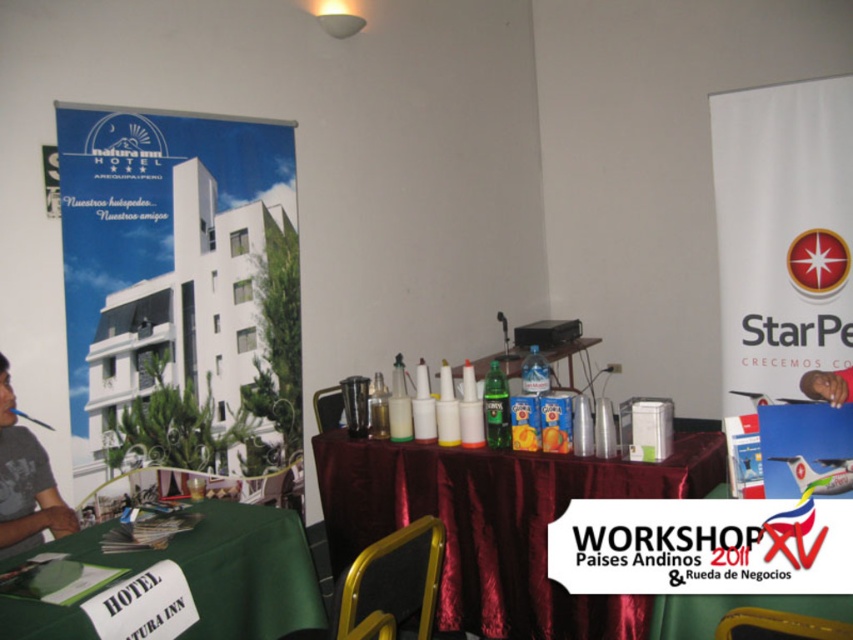
Question: Does maroon satin tablecloth at center appear on the right side of translucent plastic bottles at center?

Choices:
 (A) no
 (B) yes

Answer: (A)

Question: Which object is positioned farthest from the smooth skin face at center?

Choices:
 (A) maroon satin tablecloth at center
 (B) gray t-shirt at left

Answer: (B)

Question: Which point appears farthest from the camera in this image?

Choices:
 (A) (49, 513)
 (B) (515, 616)
 (C) (264, 580)
 (D) (805, 372)

Answer: (D)

Question: Is maroon satin tablecloth at center further to camera compared to green fabric tablecloth at lower left?

Choices:
 (A) no
 (B) yes

Answer: (B)

Question: Can you confirm if translucent plastic bottles at center is wider than smooth skin face at center?

Choices:
 (A) no
 (B) yes

Answer: (B)

Question: Which point is closer to the camera taking this photo?

Choices:
 (A) (361, 545)
 (B) (73, 531)

Answer: (B)